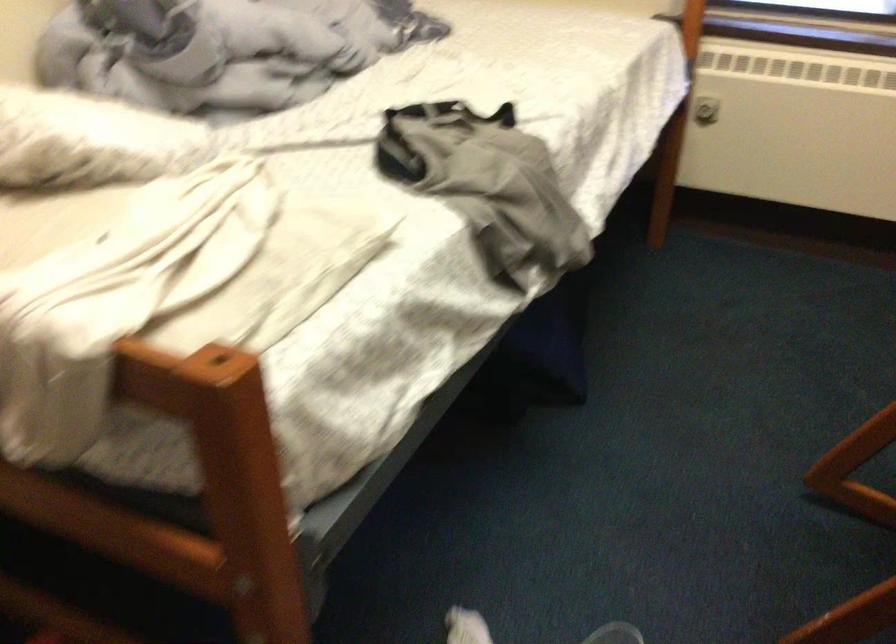
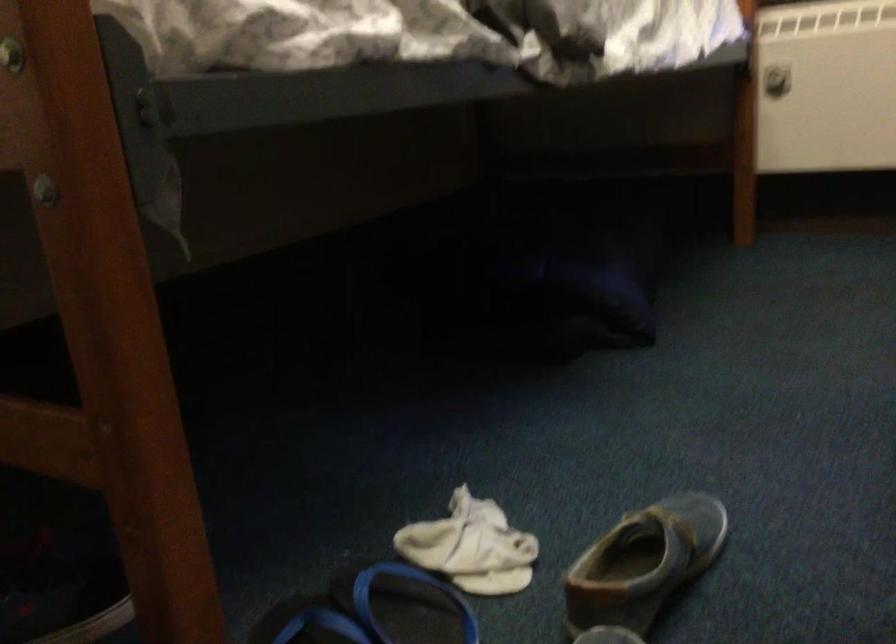
In the second image, find the point that corresponds to (716,116) in the first image.

(776, 80)